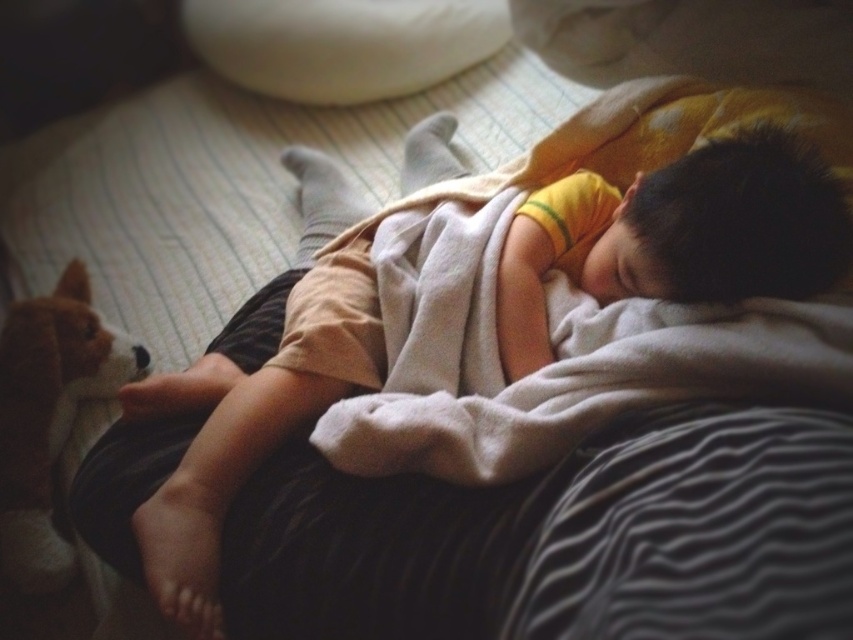
You are a parent checking on your child. You see the soft yellow shirt at center and the brown plush dog at lower left. How far apart are these two items?

The soft yellow shirt at center is 13.90 inches away from the brown plush dog at lower left.

You are standing in the room and want to place a small nightlight between the two points, point [260,1] and point [26,550]. Which point should the nightlight be closer to so it doesn t block the path to the bed?

The nightlight should be placed closer to point [26,550] because point [260,1] is behind point [26,550], so placing it near the front point would avoid blocking the path to the bed.

You are a parent checking on your child. You see the white soft pillow at upper center and the brown plush dog at lower left. Which object is positioned to the right side of the other?

The white soft pillow at upper center is positioned to the right of the brown plush dog at lower left.